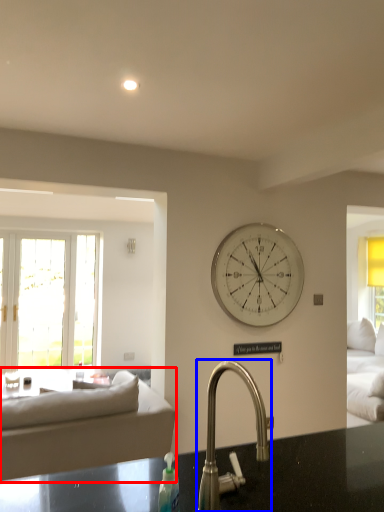
Question: Which point is closer to the camera, studio couch (highlighted by a red box) or tap (highlighted by a blue box)?

Choices:
 (A) studio couch
 (B) tap

Answer: (B)